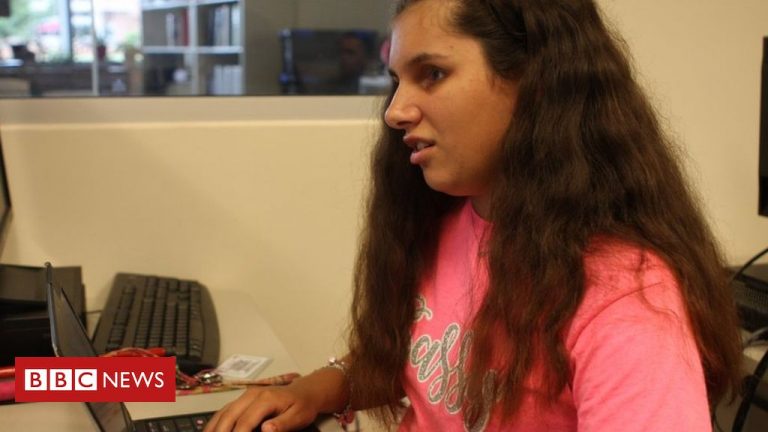
You are a GUI agent. You are given a task and a screenshot of the screen. Output one action in this format:
    pyautogui.click(x=<x>, y=<y>)
    Task: Click on the books
    Image resolution: width=768 pixels, height=432 pixels.
    Given the screenshot: What is the action you would take?
    pyautogui.click(x=219, y=71), pyautogui.click(x=220, y=29), pyautogui.click(x=161, y=29), pyautogui.click(x=170, y=68)